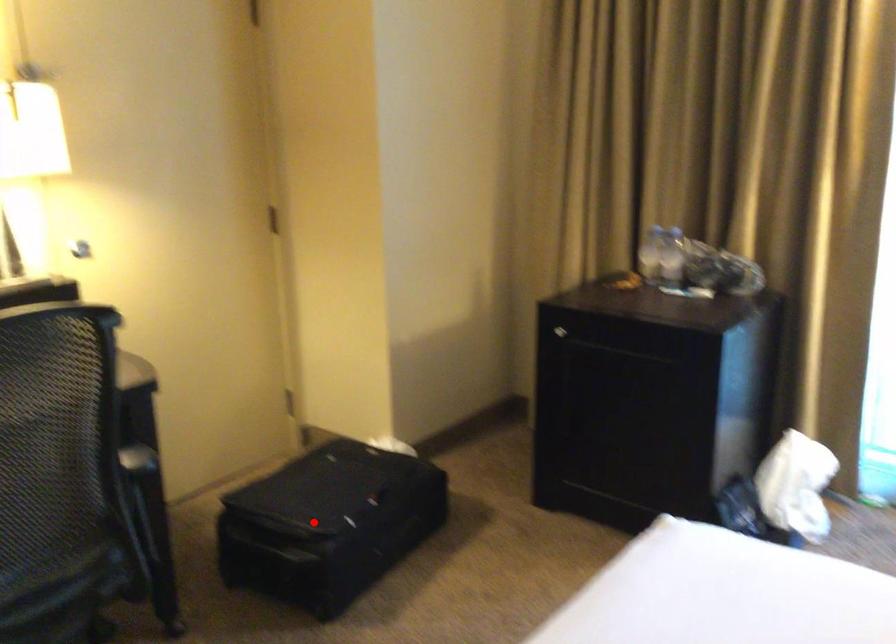
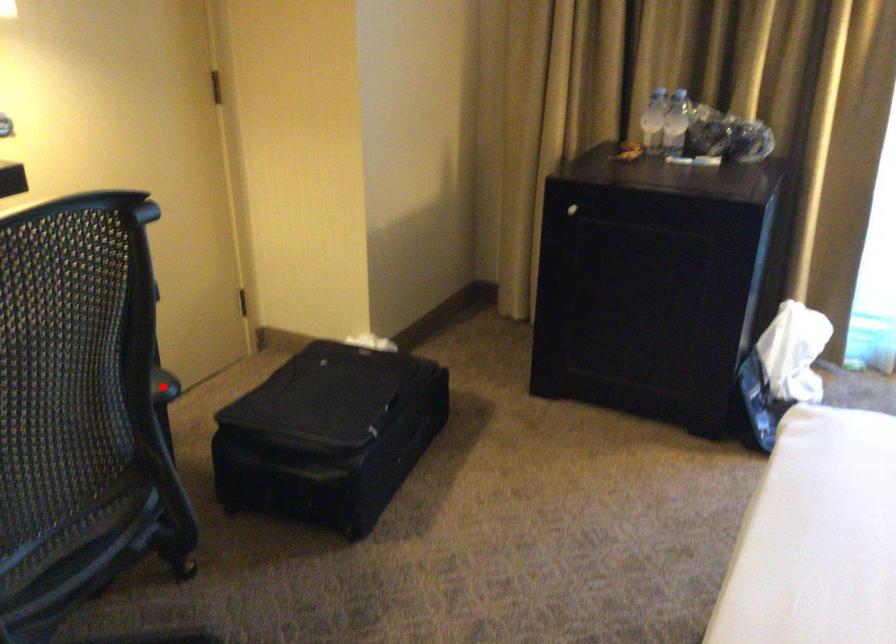
I am providing you with two images of the same scene from different viewpoints. A red point is marked on the first image and another point is marked on the second image. Do the highlighted points in image1 and image2 indicate the same real-world spot?

No